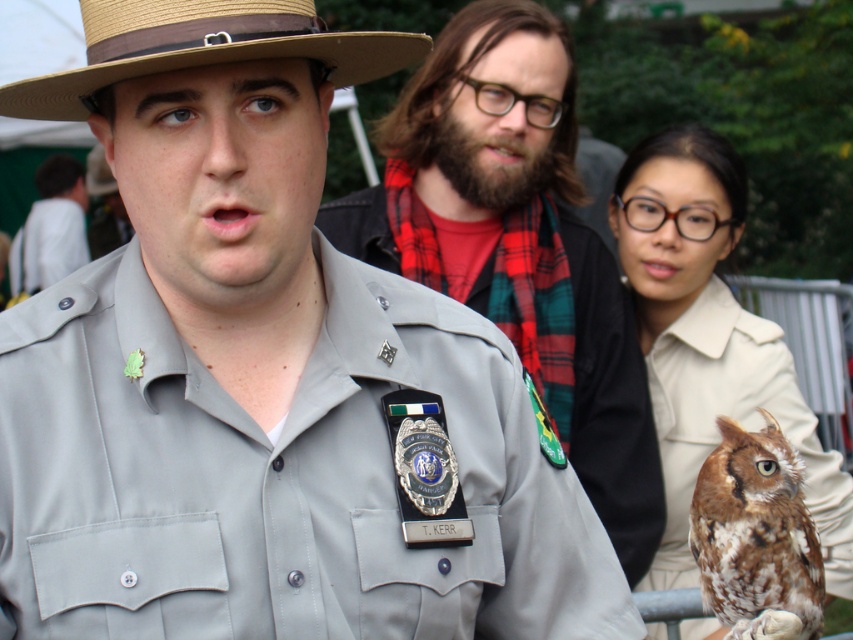
Question: Can you confirm if gray uniform at center is positioned above natural straw hat at upper left?

Choices:
 (A) yes
 (B) no

Answer: (B)

Question: Which point is closer to the camera?

Choices:
 (A) natural straw hat at upper left
 (B) white fabric at left

Answer: (A)

Question: Which point is farther to the camera?

Choices:
 (A) pyautogui.click(x=33, y=252)
 (B) pyautogui.click(x=550, y=328)

Answer: (A)

Question: Is gray uniform at center wider than brown speckled feathers at right?

Choices:
 (A) yes
 (B) no

Answer: (A)

Question: Which object appears closest to the camera in this image?

Choices:
 (A) gray uniform at center
 (B) brown speckled feathers at right

Answer: (B)

Question: Is gray uniform at center closer to the viewer compared to white fabric at left?

Choices:
 (A) yes
 (B) no

Answer: (A)